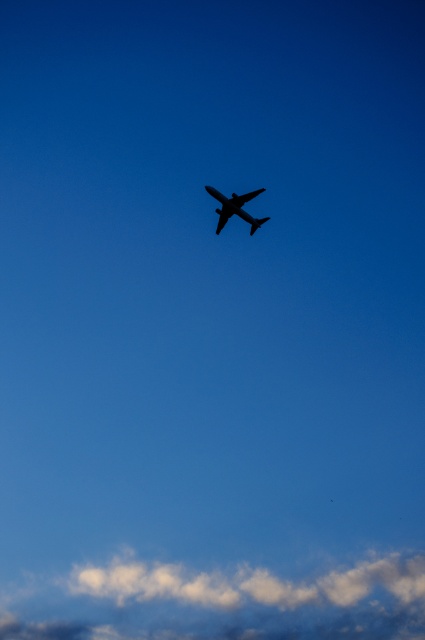
Question: Is white fluffy cloud at lower center positioned behind black matte airplane at center?

Choices:
 (A) no
 (B) yes

Answer: (A)

Question: Which point is closer to the camera taking this photo?

Choices:
 (A) (249, 195)
 (B) (362, 561)

Answer: (A)

Question: In this image, where is white fluffy cloud at lower center located relative to black matte airplane at center?

Choices:
 (A) below
 (B) above

Answer: (A)

Question: Can you confirm if white fluffy cloud at lower center is positioned above black matte airplane at center?

Choices:
 (A) yes
 (B) no

Answer: (B)

Question: Which point is farther to the camera?

Choices:
 (A) black matte airplane at center
 (B) white fluffy cloud at lower center

Answer: (A)

Question: Which point is farther from the camera taking this photo?

Choices:
 (A) (331, 602)
 (B) (217, 227)

Answer: (B)